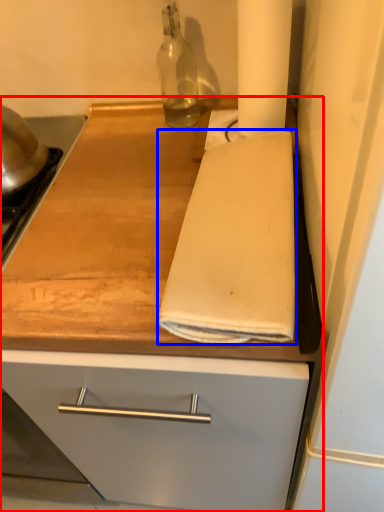
Question: Which of the following is the closest to the observer, countertop (highlighted by a red box) or bath towel (highlighted by a blue box)?

Choices:
 (A) countertop
 (B) bath towel

Answer: (A)